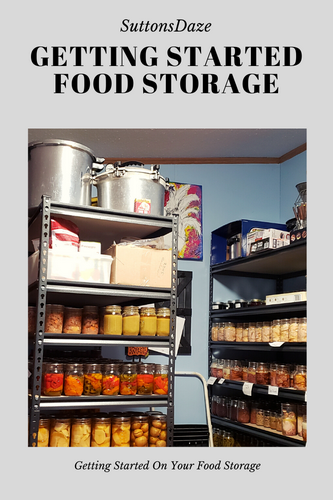
At what (x,y) coordinates should I click in order to perform the action: click on blue walls. Please return your answer as a coordinate pair (x, y). The image size is (333, 500). Looking at the image, I should click on (200, 298), (185, 399), (227, 196), (298, 170).